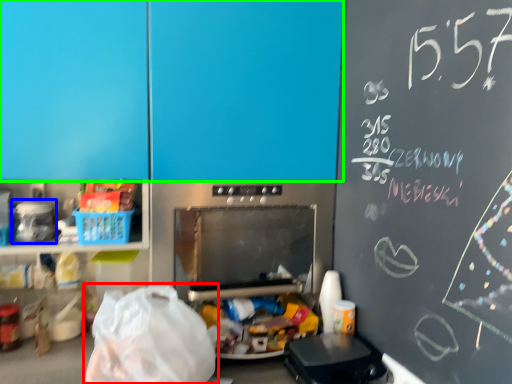
Question: Which is farther away from grocery bag (highlighted by a red box)? appliance (highlighted by a blue box) or leftover (highlighted by a green box)?

Choices:
 (A) appliance
 (B) leftover

Answer: (B)